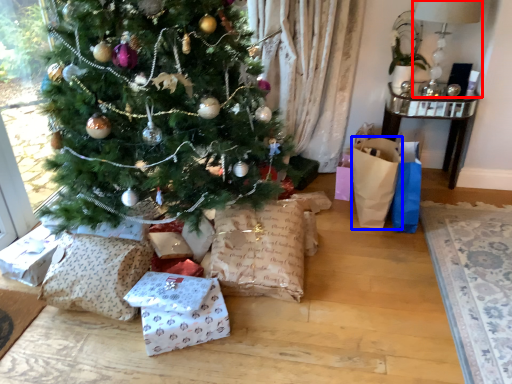
Question: Which of the following is the closest to the observer, lamp (highlighted by a red box) or gift bag (highlighted by a blue box)?

Choices:
 (A) lamp
 (B) gift bag

Answer: (B)